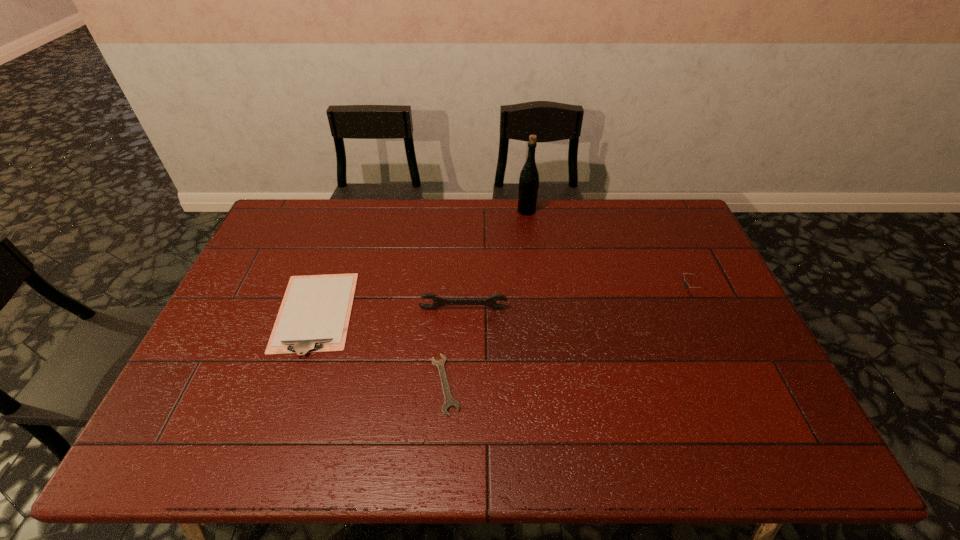
I want to click on free area in between the beer bottle and the second shortest object, so click(x=420, y=262).

Choose which object is the fourth nearest neighbor to the taller wrench. Please provide its 2D coordinates. Your answer should be formatted as a tuple, i.e. [(x, y)], where the tuple contains the x and y coordinates of a point satisfying the conditions above.

[(686, 284)]

Locate an element on the screen. This screenshot has width=960, height=540. object that stands as the fourth closest to the taller wrench is located at coordinates (686, 284).

Find the location of a particular element. The image size is (960, 540). free space that satisfies the following two spatial constraints: 1. in front of the lenses of the rightmost object; 2. on the front side of the fourth tallest object is located at coordinates (698, 313).

At what (x,y) coordinates should I click in order to perform the action: click on free location that satisfies the following two spatial constraints: 1. on the front side of the shortest object; 2. on the right side of the clipboard. Please return your answer as a coordinate pair (x, y). Looking at the image, I should click on (290, 384).